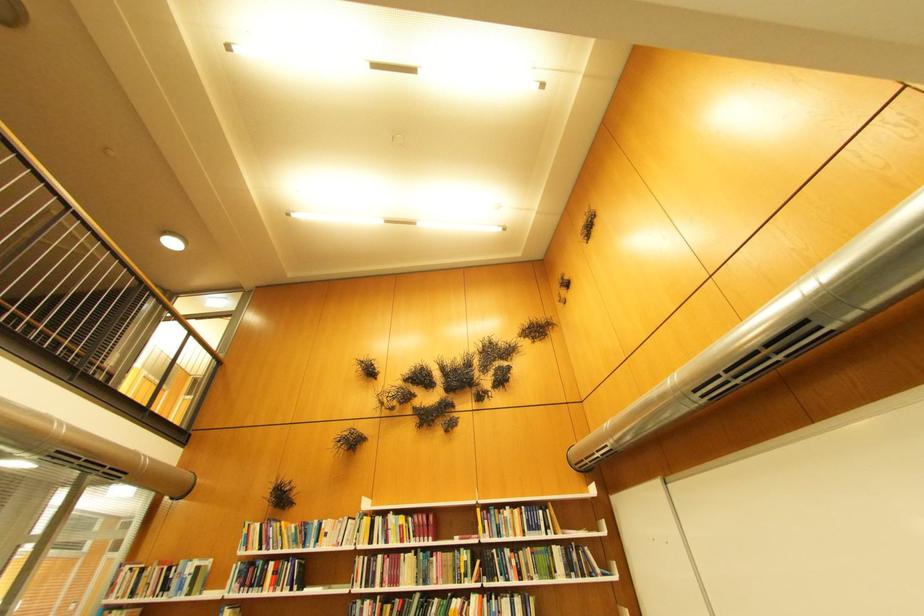
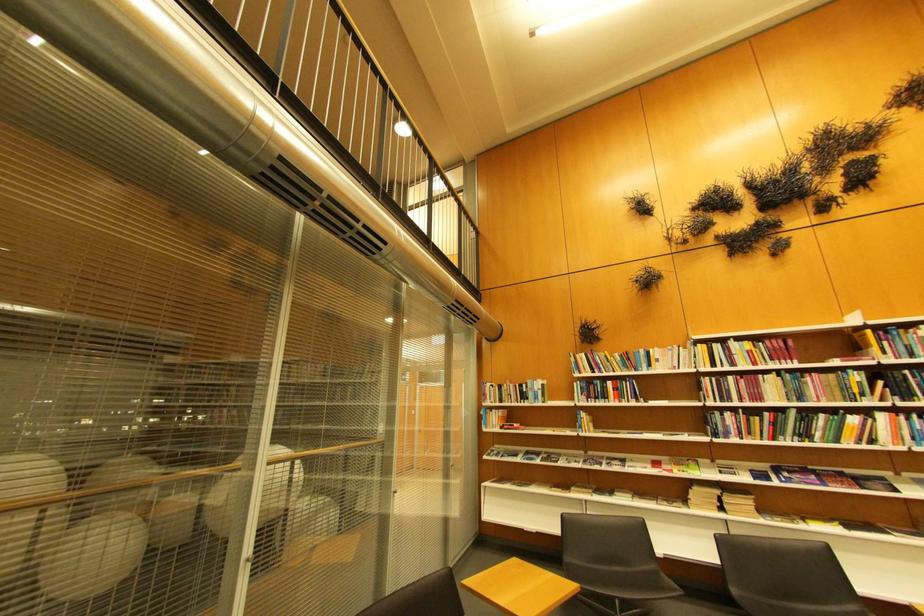
Locate, in the second image, the point that corresponds to point (391, 559) in the first image.

(740, 379)